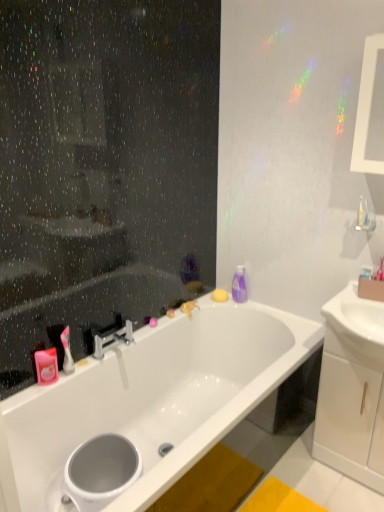
Describe the element at coordinates (100, 471) in the screenshot. I see `white glossy toilet bowl at lower left` at that location.

Identify the location of white glossy cabinet at right. The height and width of the screenshot is (512, 384). (346, 407).

The height and width of the screenshot is (512, 384). Describe the element at coordinates (355, 328) in the screenshot. I see `white glossy sink at right` at that location.

What do you see at coordinates (112, 339) in the screenshot? I see `silver metallic faucet at center` at bounding box center [112, 339].

What do you see at coordinates (152, 399) in the screenshot? I see `white glossy bathtub at center` at bounding box center [152, 399].

The image size is (384, 512). In order to click on white glossy toilet bowl at lower left in this screenshot , I will do `click(100, 471)`.

Would you say pink matte soap at upper left, arranged as the second toiletry when viewed from the right, is outside white glossy sink at right?

pink matte soap at upper left, arranged as the second toiletry when viewed from the right, is positioned outside white glossy sink at right.

How much distance is there between pink matte soap at upper left, arranged as the second toiletry when viewed from the right, and white glossy sink at right?

1.23 meters.

Between pink matte soap at upper left, placed as the 2th toiletry when sorted from top to bottom, and white glossy sink at right, which one is positioned behind?

pink matte soap at upper left, placed as the 2th toiletry when sorted from top to bottom.

Considering the positions of point (51, 361) and point (357, 312), is point (51, 361) closer or farther from the camera than point (357, 312)?

Point (51, 361) appears to be farther away from the viewer than point (357, 312).

Consider the image. How distant is white glossy bathtub at center from white glossy cabinet at right?

white glossy bathtub at center is 21.16 inches from white glossy cabinet at right.

From a real-world perspective, relative to white glossy cabinet at right, is white glossy bathtub at center vertically above or below?

In terms of real-world spatial position, white glossy bathtub at center is below white glossy cabinet at right.

Can you confirm if white glossy bathtub at center is positioned to the right of white glossy cabinet at right?

No, white glossy bathtub at center is not to the right of white glossy cabinet at right.

Which is closer to the camera, (138,410) or (325,354)?

The point (325,354) is in front.

Is white glossy toilet bowl at lower left oriented away from white glossy cabinet at right?

That's not correct — white glossy toilet bowl at lower left is not looking away from white glossy cabinet at right.

From the image's perspective, who appears lower, white glossy toilet bowl at lower left or white glossy cabinet at right?

white glossy toilet bowl at lower left, from the image's perspective.

Considering the sizes of white glossy toilet bowl at lower left and white glossy cabinet at right in the image, is white glossy toilet bowl at lower left taller or shorter than white glossy cabinet at right?

white glossy toilet bowl at lower left is shorter than white glossy cabinet at right.

Who is bigger, white glossy toilet bowl at lower left or white glossy cabinet at right?

With larger size is white glossy cabinet at right.

In the scene shown: Is purple glossy bottle at upper right, which appears as the second toiletry when ordered from the bottom, placed right next to white glossy bathtub at center?

There is a gap between purple glossy bottle at upper right, which appears as the second toiletry when ordered from the bottom, and white glossy bathtub at center.

Between purple glossy bottle at upper right, the 1th toiletry from the back, and white glossy bathtub at center, which one has smaller width?

purple glossy bottle at upper right, the 1th toiletry from the back.

Considering the relative sizes of purple glossy bottle at upper right, which is the second toiletry from left to right, and white glossy bathtub at center in the image provided, is purple glossy bottle at upper right, which is the second toiletry from left to right, bigger than white glossy bathtub at center?

Actually, purple glossy bottle at upper right, which is the second toiletry from left to right, might be smaller than white glossy bathtub at center.

Considering the positions of objects purple glossy bottle at upper right, the 1th toiletry from the back, and white glossy bathtub at center in the image provided, who is in front, purple glossy bottle at upper right, the 1th toiletry from the back, or white glossy bathtub at center?

white glossy bathtub at center is in front.

Does white glossy sink at right come behind white glossy cabinet at right?

No.

Which is more to the right, white glossy sink at right or white glossy cabinet at right?

From the viewer's perspective, white glossy cabinet at right appears more on the right side.

Between white glossy sink at right and white glossy cabinet at right, which one has smaller size?

white glossy sink at right is smaller.

From the image's perspective, which one is positioned lower, white glossy sink at right or white glossy cabinet at right?

From the image's view, white glossy cabinet at right is below.

How different are the orientations of white glossy toilet bowl at lower left and white glossy bathtub at center in degrees?

The angle between the facing direction of white glossy toilet bowl at lower left and the facing direction of white glossy bathtub at center is 6.1e-05 degrees.

In the scene shown: How far apart are white glossy toilet bowl at lower left and white glossy bathtub at center?

white glossy toilet bowl at lower left and white glossy bathtub at center are 13.79 inches apart from each other.

Who is shorter, white glossy toilet bowl at lower left or white glossy bathtub at center?

white glossy toilet bowl at lower left.

Find the location of a particular element. The width and height of the screenshot is (384, 512). bathtub above the white glossy toilet bowl at lower left (from a real-world perspective) is located at coordinates (152, 399).

Is white glossy sink at right looking in the opposite direction of white glossy bathtub at center?

No, white glossy sink at right's orientation is not away from white glossy bathtub at center.

Are white glossy sink at right and white glossy bathtub at center making contact?

No.

Which is in front, white glossy sink at right or white glossy bathtub at center?

Positioned in front is white glossy bathtub at center.

Considering the relative sizes of white glossy sink at right and white glossy bathtub at center in the image provided, is white glossy sink at right thinner than white glossy bathtub at center?

Indeed, white glossy sink at right has a lesser width compared to white glossy bathtub at center.

Locate an element on the screen. The height and width of the screenshot is (512, 384). sink on the right of pink matte soap at upper left, marked as the 1th toiletry in a bottom-to-top arrangement is located at coordinates (355, 328).

Image resolution: width=384 pixels, height=512 pixels. I want to click on bathtub below the white glossy cabinet at right (from the image's perspective), so click(x=152, y=399).

Considering their positions, is white glossy bathtub at center positioned closer to pink matte soap at upper left, which is the 2th toiletry in back-to-front order, than white glossy sink at right?

white glossy bathtub at center.

When comparing their distances from white glossy toilet bowl at lower left, does white glossy bathtub at center or purple glossy bottle at upper right, the 1th toiletry from the back, seem closer?

white glossy bathtub at center.

Looking at the image, which one is located further to white glossy sink at right, purple glossy bottle at upper right, which is the second toiletry from left to right, or silver metallic faucet at center?

Based on the image, silver metallic faucet at center appears to be further to white glossy sink at right.

When comparing their distances from white glossy toilet bowl at lower left, does white glossy cabinet at right or pink matte soap at upper left, which is the 1th toiletry in front-to-back order, seem further?

white glossy cabinet at right.

Based on the photo, looking at the image, which one is located closer to pink matte soap at upper left, arranged as the second toiletry when viewed from the right, silver metallic faucet at center or purple glossy bottle at upper right, the 2th toiletry from the front?

The object closer to pink matte soap at upper left, arranged as the second toiletry when viewed from the right, is silver metallic faucet at center.

Looking at this image, considering their positions, is white glossy toilet bowl at lower left positioned further to pink matte soap at upper left, marked as the 1th toiletry in a bottom-to-top arrangement, than white glossy sink at right?

The object further to pink matte soap at upper left, marked as the 1th toiletry in a bottom-to-top arrangement, is white glossy sink at right.

Looking at the image, which one is located further to silver metallic faucet at center, white glossy sink at right or white glossy bathtub at center?

The object further to silver metallic faucet at center is white glossy sink at right.

From the image, which object appears to be farther from white glossy cabinet at right, silver metallic faucet at center or white glossy bathtub at center?

silver metallic faucet at center is positioned further to the anchor white glossy cabinet at right.

You are a GUI agent. You are given a task and a screenshot of the screen. Output one action in this format:
    pyautogui.click(x=<x>, y=<y>)
    Task: Click on the sink situated between white glossy toilet bowl at lower left and white glossy cabinet at right from left to right
    This screenshot has width=384, height=512.
    Given the screenshot: What is the action you would take?
    pyautogui.click(x=355, y=328)

Locate an element on the screen. The image size is (384, 512). tap between pink matte soap at upper left, marked as the 1th toiletry in a bottom-to-top arrangement, and white glossy sink at right from left to right is located at coordinates (112, 339).

Locate an element on the screen. The height and width of the screenshot is (512, 384). toiletry situated between white glossy toilet bowl at lower left and white glossy cabinet at right from left to right is located at coordinates (239, 285).

Locate an element on the screen. sink located between white glossy bathtub at center and purple glossy bottle at upper right, which appears as the second toiletry when ordered from the bottom, in the depth direction is located at coordinates (355, 328).